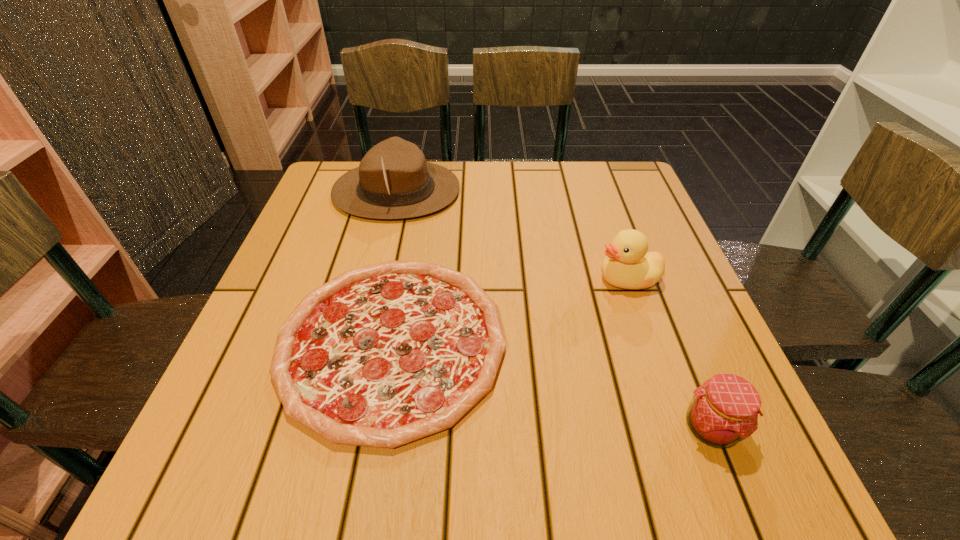
I want to click on vacant space located 0.230m on the back of the pizza, so click(417, 204).

Image resolution: width=960 pixels, height=540 pixels. What are the coordinates of `object that is at the far edge` in the screenshot? It's located at (393, 181).

Find the location of a particular element. This screenshot has width=960, height=540. jam located in the near edge section of the desktop is located at coordinates [724, 410].

You are a GUI agent. You are given a task and a screenshot of the screen. Output one action in this format:
    pyautogui.click(x=<x>, y=<y>)
    Task: Click on the pizza that is at the near edge
    This screenshot has width=960, height=540.
    Given the screenshot: What is the action you would take?
    pyautogui.click(x=383, y=355)

Image resolution: width=960 pixels, height=540 pixels. What are the coordinates of `fedora located in the left edge section of the desktop` in the screenshot? It's located at (393, 181).

Image resolution: width=960 pixels, height=540 pixels. Find the location of `pizza positioned at the left edge`. pizza positioned at the left edge is located at coordinates (383, 355).

I want to click on duck that is at the right edge, so click(628, 265).

Where is `jam situated at the right edge`? This screenshot has width=960, height=540. jam situated at the right edge is located at coordinates (724, 410).

The height and width of the screenshot is (540, 960). I want to click on object at the far left corner, so [393, 181].

Where is `object that is at the near left corner`? object that is at the near left corner is located at coordinates (383, 355).